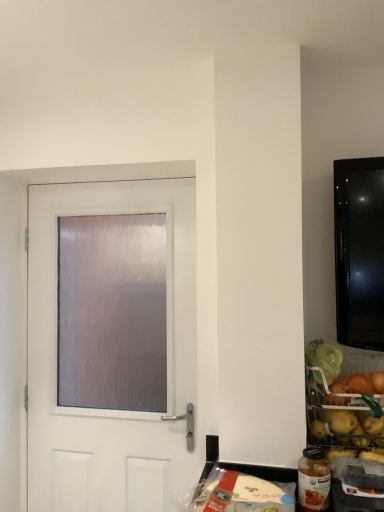
At what (x,y) coordinates should I click in order to perform the action: click on white matte door at center. Please return your answer as a coordinate pair (x, y). Looking at the image, I should click on pyautogui.click(x=111, y=410).

Could you tell me if translucent plastic bag at lower center, which is the 2th food in right-to-left order, is facing white matte door at center?

No.

From a real-world perspective, is translucent plastic bag at lower center, the first food positioned from the left, positioned over white matte door at center based on gravity?

Incorrect, from a real-world perspective, translucent plastic bag at lower center, the first food positioned from the left, is lower than white matte door at center.

Can you tell me how much translucent plastic bag at lower center, which is the 2th food in right-to-left order, and white matte door at center differ in facing direction?

translucent plastic bag at lower center, which is the 2th food in right-to-left order, and white matte door at center are facing 1.6 degrees away from each other.

Does translucent plastic bag at lower center, arranged as the second food when viewed from the top, contain white matte door at center?

That's incorrect, white matte door at center is not inside translucent plastic bag at lower center, arranged as the second food when viewed from the top.

Identify the location of food above the translucent plastic bag at lower center, which is counted as the 1th food, starting from the bottom (from a real-world perspective). (342, 403).

In the scene shown: Could you tell me if translucent plastic bag at lower center, arranged as the second food when viewed from the top, is turned towards golden potatoes at right, the first food in the top-to-bottom sequence?

No, translucent plastic bag at lower center, arranged as the second food when viewed from the top, does not turn towards golden potatoes at right, the first food in the top-to-bottom sequence.

Can you confirm if translucent plastic bag at lower center, the first food positioned from the left, is thinner than golden potatoes at right, which is the second food from bottom to top?

Incorrect, the width of translucent plastic bag at lower center, the first food positioned from the left, is not less than that of golden potatoes at right, which is the second food from bottom to top.

Looking at this image, from a real-world perspective, is white matte door at center physically below golden potatoes at right, arranged as the 2th food when viewed from the left?

No, from a real-world perspective, white matte door at center is not under golden potatoes at right, arranged as the 2th food when viewed from the left.

Considering the relative positions of white matte door at center and golden potatoes at right, which is the second food from bottom to top, in the image provided, is white matte door at center to the left or to the right of golden potatoes at right, which is the second food from bottom to top,?

white matte door at center is positioned on golden potatoes at right, which is the second food from bottom to top,'s left side.

In terms of height, does white matte door at center look taller or shorter compared to golden potatoes at right, the 1th food from the right?

white matte door at center is taller than golden potatoes at right, the 1th food from the right.

Which object is closer to the camera taking this photo, white matte door at center or golden potatoes at right, the first food in the top-to-bottom sequence?

golden potatoes at right, the first food in the top-to-bottom sequence, is more forward.

Does golden potatoes at right, arranged as the 2th food when viewed from the left, lie in front of white matte door at center?

Yes, golden potatoes at right, arranged as the 2th food when viewed from the left, is closer to the camera.

Based on their positions, is golden potatoes at right, the 1th food from the right, located to the left or right of white matte door at center?

From the image, it's evident that golden potatoes at right, the 1th food from the right, is to the right of white matte door at center.

In terms of size, does golden potatoes at right, arranged as the 2th food when viewed from the left, appear bigger or smaller than white matte door at center?

Considering their sizes, golden potatoes at right, arranged as the 2th food when viewed from the left, takes up more space than white matte door at center.

Is golden potatoes at right, the first food in the top-to-bottom sequence, facing towards white matte door at center?

No.

Could translucent plastic bag at lower center, which is counted as the 1th food, starting from the bottom, be considered to be inside golden potatoes at right, the first food in the top-to-bottom sequence?

Actually, translucent plastic bag at lower center, which is counted as the 1th food, starting from the bottom, is outside golden potatoes at right, the first food in the top-to-bottom sequence.

Looking at this image, considering the relative sizes of golden potatoes at right, which is the second food from bottom to top, and translucent plastic bag at lower center, which is counted as the 1th food, starting from the bottom, in the image provided, is golden potatoes at right, which is the second food from bottom to top, taller than translucent plastic bag at lower center, which is counted as the 1th food, starting from the bottom,?

Yes, golden potatoes at right, which is the second food from bottom to top, is taller than translucent plastic bag at lower center, which is counted as the 1th food, starting from the bottom.

How far apart are golden potatoes at right, the first food in the top-to-bottom sequence, and translucent plastic bag at lower center, which is counted as the 1th food, starting from the bottom?

golden potatoes at right, the first food in the top-to-bottom sequence, and translucent plastic bag at lower center, which is counted as the 1th food, starting from the bottom, are 12.48 inches apart from each other.

Consider the image. Which object is thinner, golden potatoes at right, arranged as the 2th food when viewed from the left, or translucent plastic bag at lower center, arranged as the second food when viewed from the top?

Thinner between the two is golden potatoes at right, arranged as the 2th food when viewed from the left.

Would you say white matte door at center is inside or outside translucent plastic bag at lower center, which is counted as the 1th food, starting from the bottom?

white matte door at center is not enclosed by translucent plastic bag at lower center, which is counted as the 1th food, starting from the bottom.

From their relative heights in the image, would you say white matte door at center is taller or shorter than translucent plastic bag at lower center, which is counted as the 1th food, starting from the bottom?

white matte door at center is taller than translucent plastic bag at lower center, which is counted as the 1th food, starting from the bottom.

You are a GUI agent. You are given a task and a screenshot of the screen. Output one action in this format:
    pyautogui.click(x=<x>, y=<y>)
    Task: Click on the door that is above the translucent plastic bag at lower center, the first food positioned from the left (from the image's perspective)
    This screenshot has height=512, width=384.
    Given the screenshot: What is the action you would take?
    pyautogui.click(x=111, y=410)

Locate an element on the screen. door behind the translucent plastic bag at lower center, the first food positioned from the left is located at coordinates (111, 410).

At what (x,y) coordinates should I click in order to perform the action: click on food that is on the left side of golden potatoes at right, the first food in the top-to-bottom sequence. Please return your answer as a coordinate pair (x, y). Looking at the image, I should click on (242, 494).

When comparing their distances from white matte door at center, does golden potatoes at right, the first food in the top-to-bottom sequence, or translucent plastic bag at lower center, which is the 2th food in right-to-left order, seem further?

Based on the image, translucent plastic bag at lower center, which is the 2th food in right-to-left order, appears to be further to white matte door at center.

Considering their positions, is white matte door at center positioned closer to golden potatoes at right, the 1th food from the right, than translucent plastic bag at lower center, which is counted as the 1th food, starting from the bottom?

Among the two, translucent plastic bag at lower center, which is counted as the 1th food, starting from the bottom, is located nearer to golden potatoes at right, the 1th food from the right.

When comparing their distances from golden potatoes at right, the first food in the top-to-bottom sequence, does translucent plastic bag at lower center, which is the 2th food in right-to-left order, or white matte door at center seem closer?

translucent plastic bag at lower center, which is the 2th food in right-to-left order, is positioned closer to the anchor golden potatoes at right, the first food in the top-to-bottom sequence.

From the image, which object appears to be nearer to translucent plastic bag at lower center, which is the 2th food in right-to-left order, white matte door at center or golden potatoes at right, the first food in the top-to-bottom sequence?

golden potatoes at right, the first food in the top-to-bottom sequence, lies closer to translucent plastic bag at lower center, which is the 2th food in right-to-left order, than the other object.

From the image, which object appears to be farther from translucent plastic bag at lower center, the first food positioned from the left, golden potatoes at right, which is the second food from bottom to top, or white matte door at center?

white matte door at center lies further to translucent plastic bag at lower center, the first food positioned from the left, than the other object.

Which object lies nearer to the anchor point white matte door at center, translucent plastic bag at lower center, arranged as the second food when viewed from the top, or golden potatoes at right, the 1th food from the right?

golden potatoes at right, the 1th food from the right, is positioned closer to the anchor white matte door at center.

At what (x,y) coordinates should I click in order to perform the action: click on food between white matte door at center and golden potatoes at right, which is the second food from bottom to top, in the horizontal direction. Please return your answer as a coordinate pair (x, y). This screenshot has width=384, height=512. Looking at the image, I should click on [x=242, y=494].